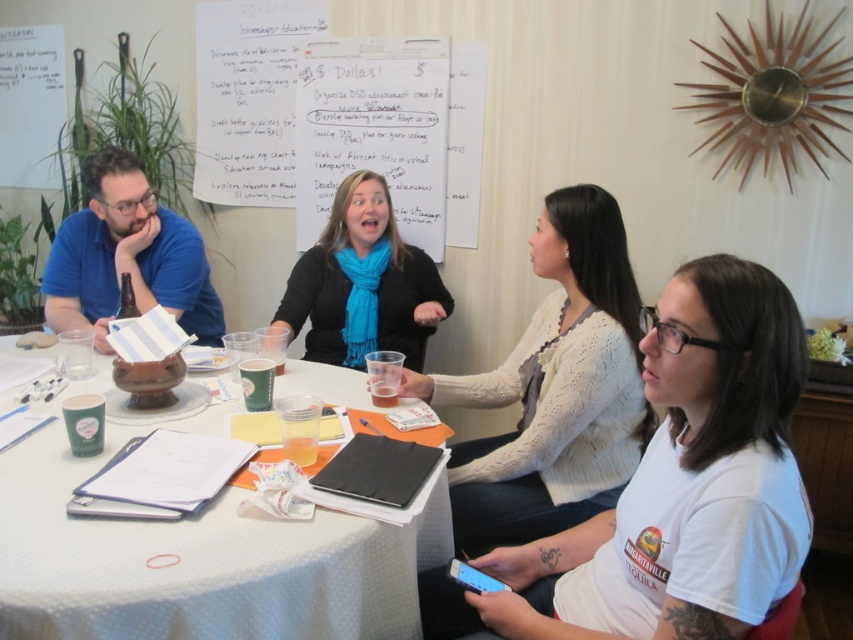
Does white cotton shirt at lower right appear on the left side of white paper at center?

No, white cotton shirt at lower right is not to the left of white paper at center.

Does white cotton shirt at lower right have a lesser height compared to white paper at center?

No.

Which is in front, point (648, 348) or point (59, 616)?

Positioned in front is point (59, 616).

Find the location of a particular element. The image size is (853, 640). white cotton shirt at lower right is located at coordinates (688, 481).

Between white paper at center and white knitted sweater at center, which one has more height?

white knitted sweater at center

Is white paper at center bigger than white knitted sweater at center?

Indeed, white paper at center has a larger size compared to white knitted sweater at center.

Locate an element on the screen. This screenshot has height=640, width=853. white paper at center is located at coordinates (198, 560).

Does white knitted sweater at center have a lesser width compared to blue scarf at center?

Incorrect, white knitted sweater at center's width is not less than blue scarf at center's.

Which of these two, white knitted sweater at center or blue scarf at center, stands shorter?

Standing shorter between the two is blue scarf at center.

Between point (602, 243) and point (341, 288), which one is positioned behind?

Point (341, 288)

Find the location of a particular element. The image size is (853, 640). white knitted sweater at center is located at coordinates (554, 388).